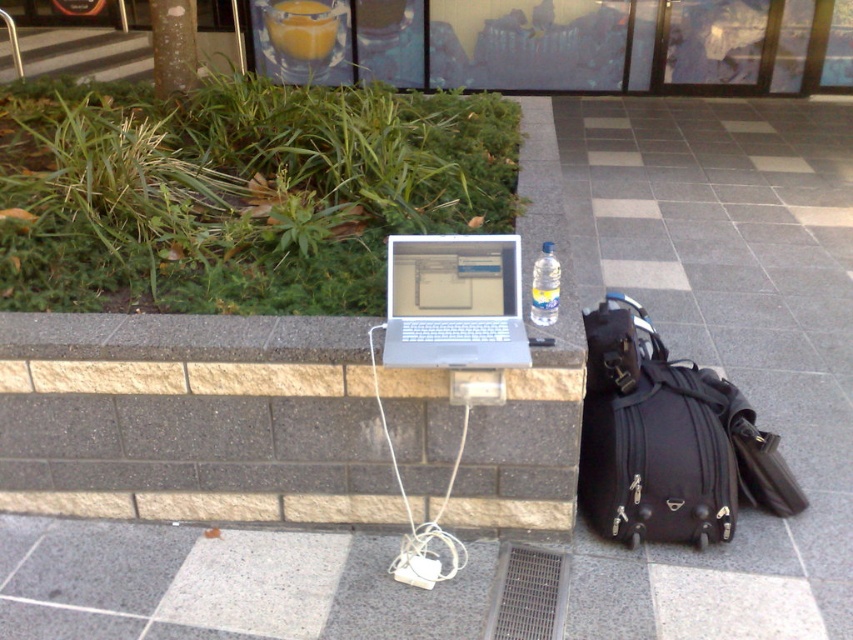
Question: Which of the following is the closest to the observer?

Choices:
 (A) silver metallic laptop at center
 (B) black fabric backpack at lower right
 (C) clear plastic bottle at center

Answer: (A)

Question: Which object is the closest to the gray concrete stairs at upper left?

Choices:
 (A) black fabric backpack at lower right
 (B) silver metallic laptop at center

Answer: (B)

Question: Considering the relative positions of black fabric backpack at lower right and gray concrete stairs at upper left in the image provided, where is black fabric backpack at lower right located with respect to gray concrete stairs at upper left?

Choices:
 (A) left
 (B) right

Answer: (B)

Question: Which of the following is the closest to the observer?

Choices:
 (A) gray concrete stairs at upper left
 (B) black fabric backpack at lower right
 (C) silver metallic laptop at center

Answer: (C)

Question: Can you confirm if smooth gray pavement at right is wider than black fabric backpack at lower right?

Choices:
 (A) yes
 (B) no

Answer: (A)

Question: Can you confirm if black fabric backpack at lower right is positioned above clear plastic bottle at center?

Choices:
 (A) yes
 (B) no

Answer: (B)